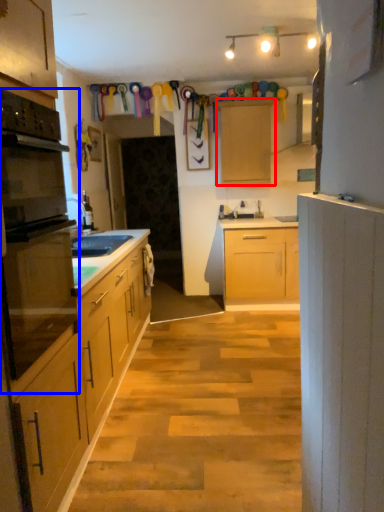
Question: Which point is closer to the camera, cabinetry (highlighted by a red box) or oven (highlighted by a blue box)?

Choices:
 (A) cabinetry
 (B) oven

Answer: (B)